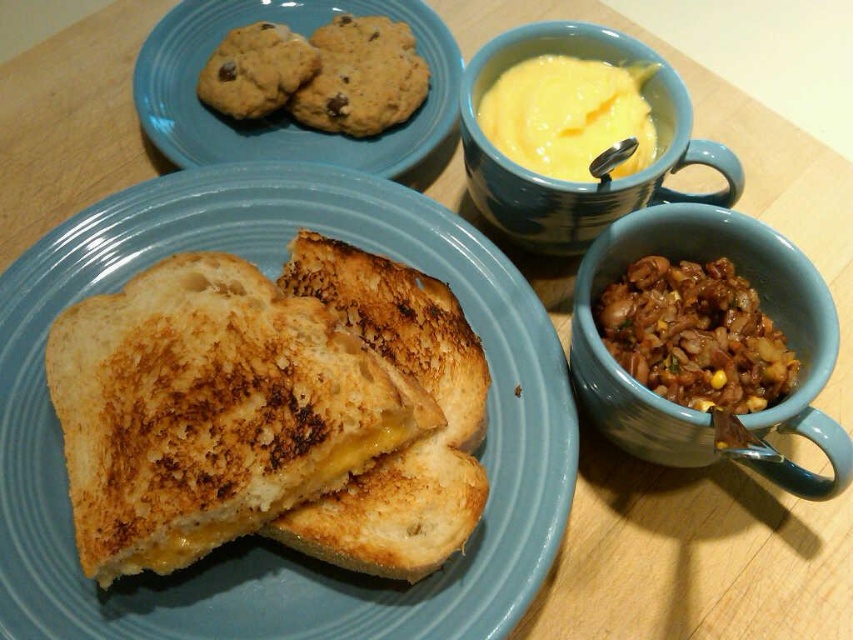
You have a yellow matte mug at upper center and a brown crumbly cookie at upper left on the table. Which one is taller?

The yellow matte mug at upper center is taller than the brown crumbly cookie at upper left.

You are setting up a table for a guest and need to place a cup to the right of the cookie plate. Is the yellow matte mug at upper center already positioned correctly relative to the brown crumbly cookie at upper left?

Yes, the yellow matte mug at upper center is already positioned to the right of the brown crumbly cookie at upper left, so it meets the requirement.